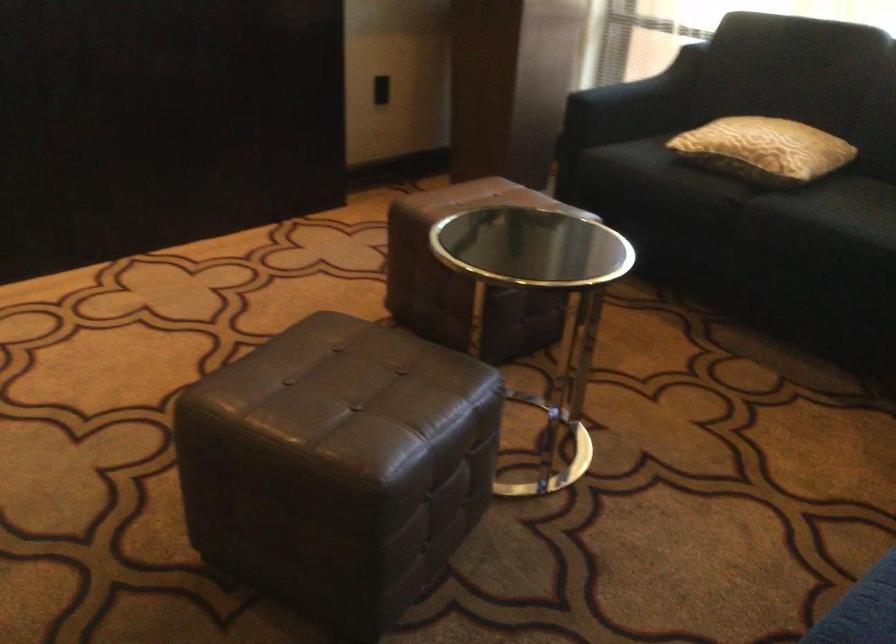
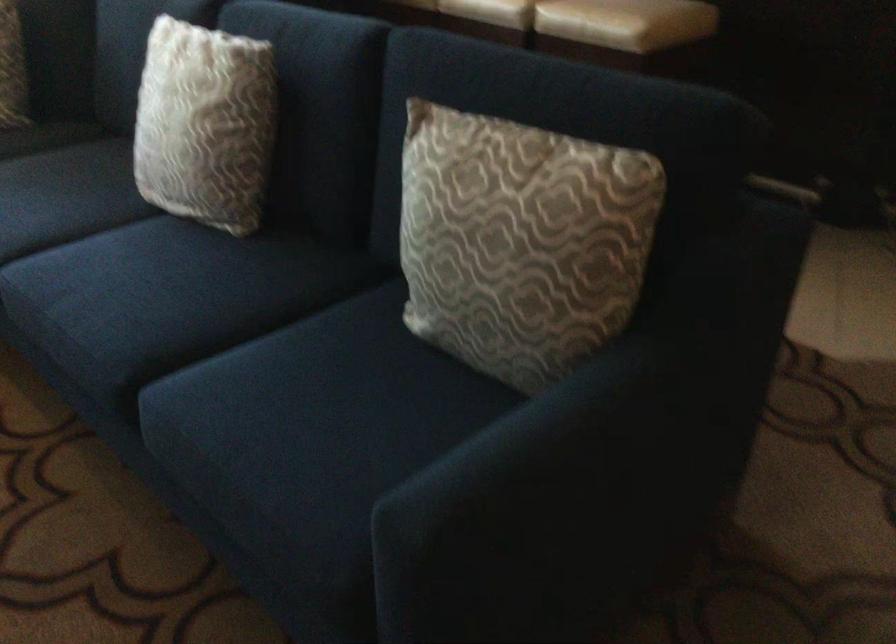
From the picture: Based on the continuous images, in which direction is the camera rotating?

The rotation direction of the camera is right-down.